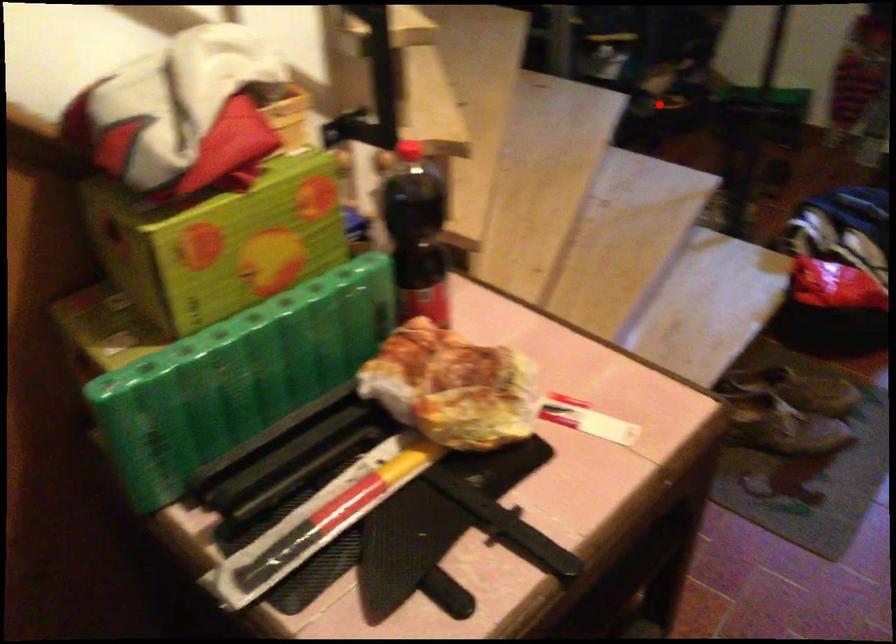
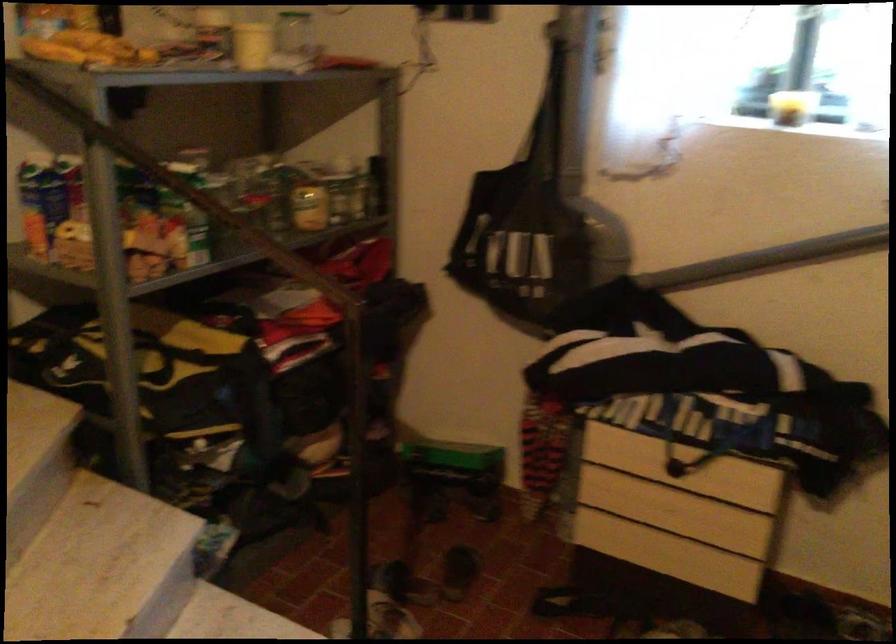
The point at the highlighted location is marked in the first image. Where is the corresponding point in the second image?

(290, 495)